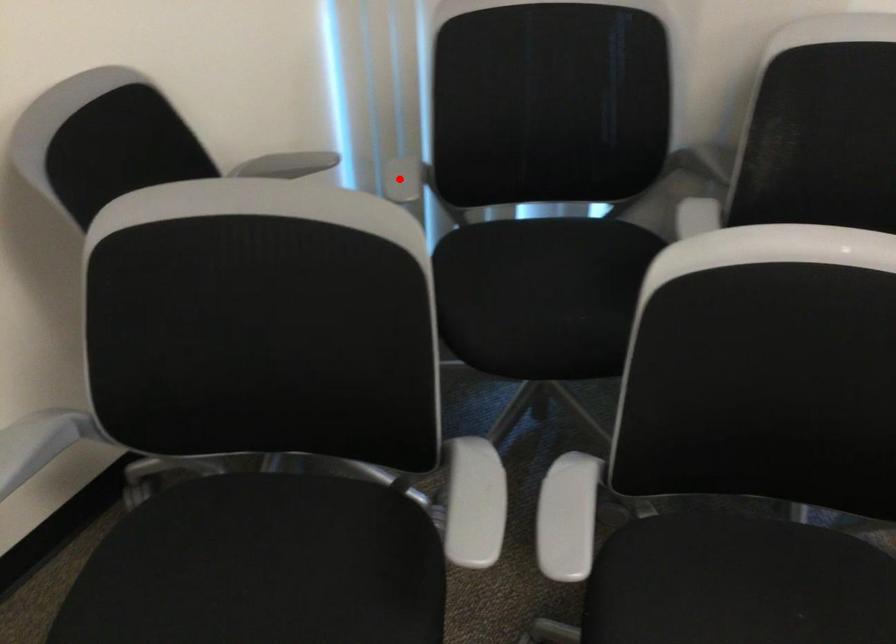
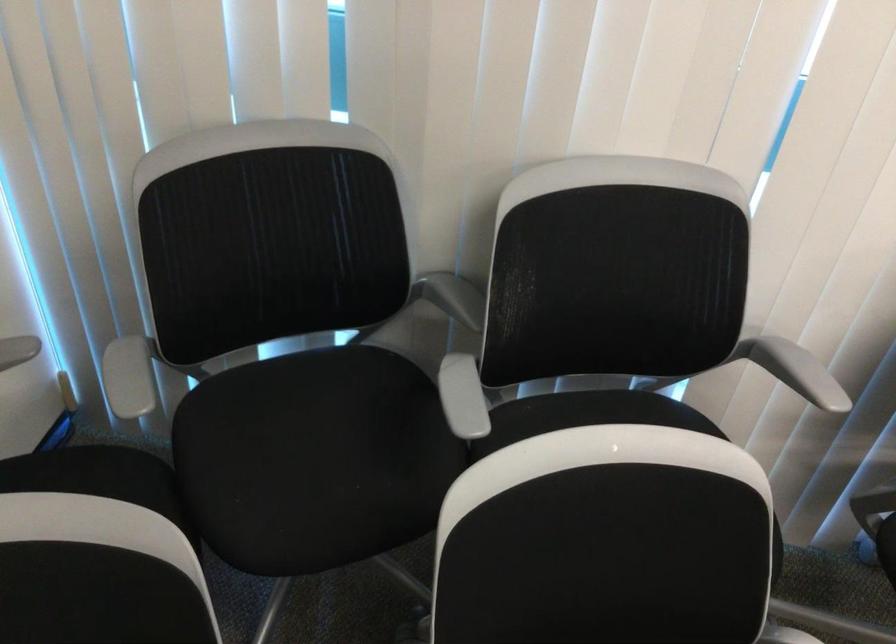
Question: I am providing you with two images of the same scene from different viewpoints. Given a red point in image1, look at the same physical point in image2. Is it:

Choices:
 (A) Closer to the viewpoint
 (B) Farther from the viewpoint

Answer: (A)